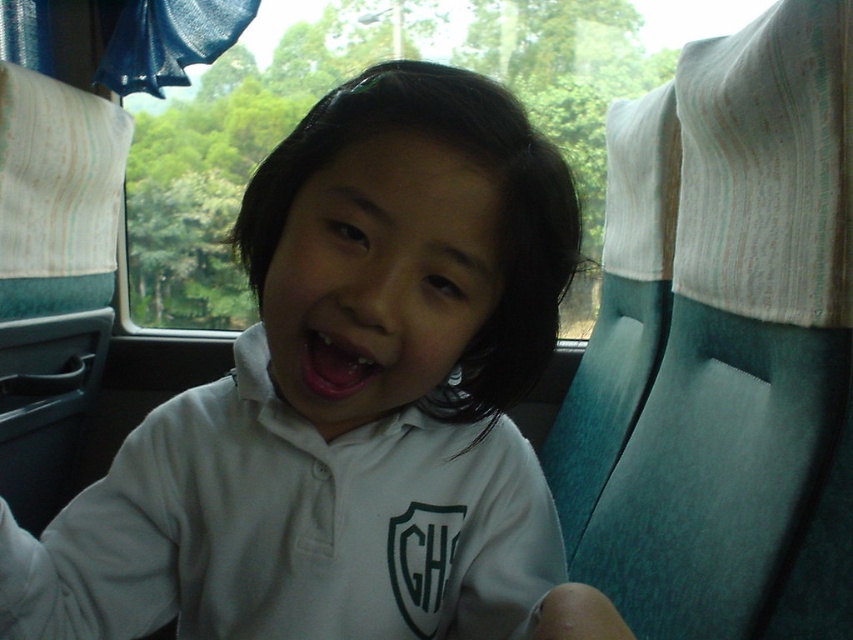
Question: Can you confirm if white matte shirt at center is positioned to the left of pink glossy lips at center?

Choices:
 (A) yes
 (B) no

Answer: (B)

Question: Does white matte shirt at center appear on the right side of pink glossy lips at center?

Choices:
 (A) yes
 (B) no

Answer: (A)

Question: Which point is farther from the camera taking this photo?

Choices:
 (A) (380, 81)
 (B) (322, 380)

Answer: (B)

Question: Does white matte shirt at center have a lesser width compared to pink glossy lips at center?

Choices:
 (A) yes
 (B) no

Answer: (B)

Question: Which point appears farthest from the camera in this image?

Choices:
 (A) (561, 208)
 (B) (341, 342)

Answer: (A)